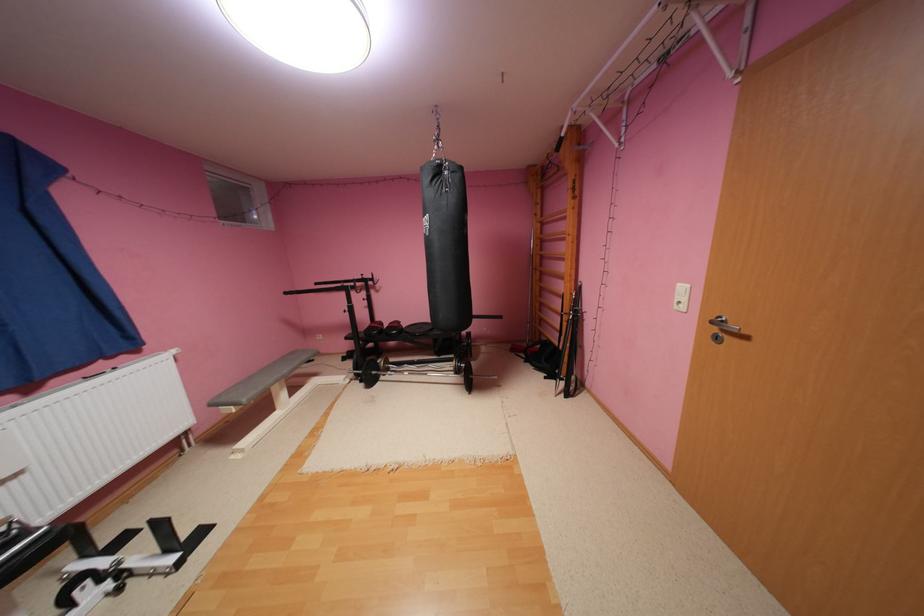
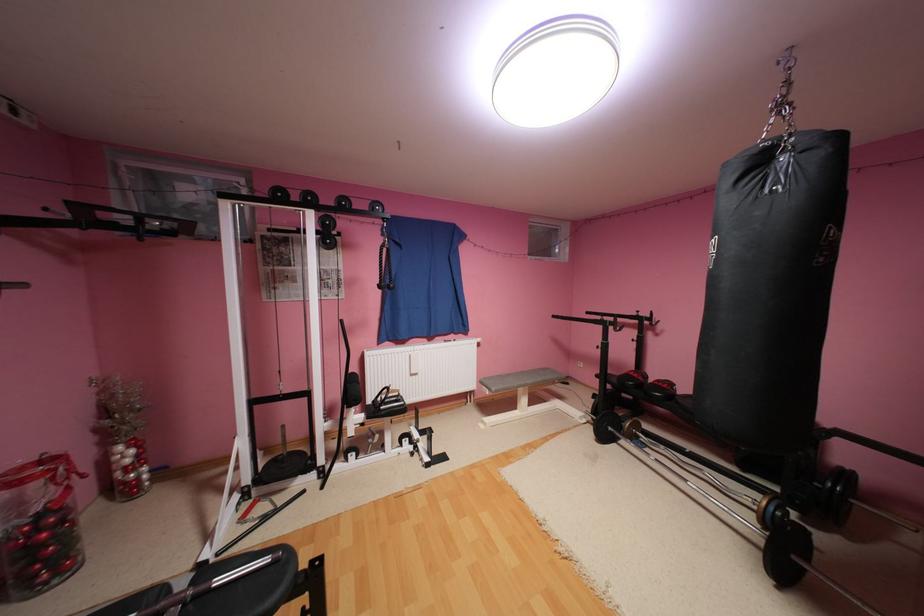
Question: How did the camera likely rotate?

Choices:
 (A) Left
 (B) Right
 (C) Up
 (D) Down

Answer: (A)